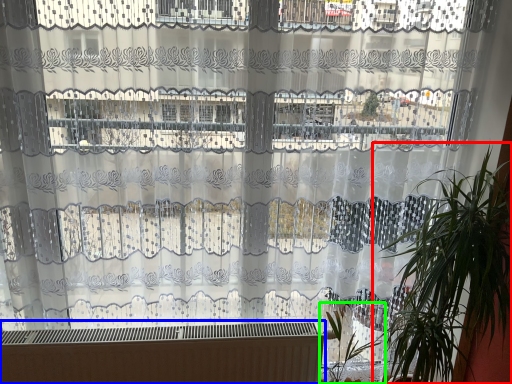
Question: Considering the real-world distances, which object is farthest from houseplant (highlighted by a red box)? heater (highlighted by a blue box) or vegetation (highlighted by a green box)?

Choices:
 (A) heater
 (B) vegetation

Answer: (A)